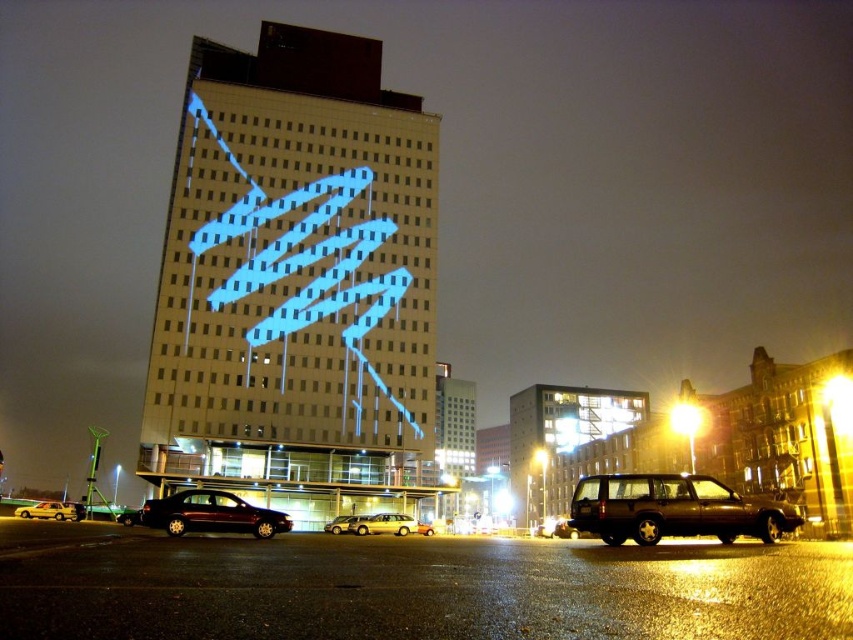
Is dark brown matte suv at lower right to the left of metallic silver station wagon at center from the viewer's perspective?

Incorrect, dark brown matte suv at lower right is not on the left side of metallic silver station wagon at center.

Which is more to the right, dark brown matte suv at lower right or metallic silver station wagon at center?

dark brown matte suv at lower right is more to the right.

Identify the location of dark brown matte suv at lower right. The height and width of the screenshot is (640, 853). (674, 509).

You are a GUI agent. You are given a task and a screenshot of the screen. Output one action in this format:
    pyautogui.click(x=<x>, y=<y>)
    Task: Click on the dark brown matte suv at lower right
    This screenshot has width=853, height=640.
    Given the screenshot: What is the action you would take?
    pyautogui.click(x=674, y=509)

Which of these two, shiny maroon sedan at lower left or shiny gold suv at center, stands taller?

With more height is shiny gold suv at center.

Is shiny maroon sedan at lower left smaller than shiny gold suv at center?

Yes.

Image resolution: width=853 pixels, height=640 pixels. Describe the element at coordinates (212, 515) in the screenshot. I see `shiny maroon sedan at lower left` at that location.

Find the location of a particular element. This screenshot has width=853, height=640. shiny maroon sedan at lower left is located at coordinates (212, 515).

Can you confirm if dark brown matte suv at lower right is shorter than white glossy sedan at lower left?

Incorrect, dark brown matte suv at lower right's height does not fall short of white glossy sedan at lower left's.

Consider the image. Does dark brown matte suv at lower right lie in front of white glossy sedan at lower left?

Yes.

Is point (669, 525) more distant than point (50, 513)?

No, (669, 525) is closer to viewer.

The width and height of the screenshot is (853, 640). Identify the location of dark brown matte suv at lower right. pos(674,509).